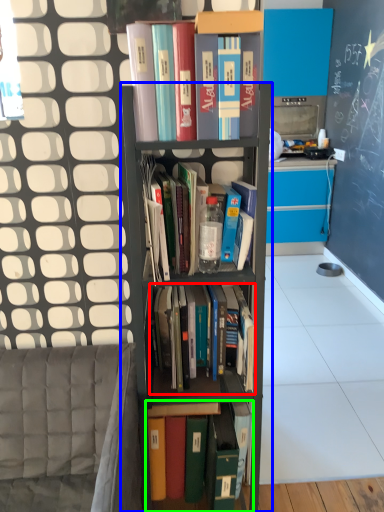
Question: Which object is positioned farthest from book (highlighted by a red box)? Select from shelf (highlighted by a blue box) and book (highlighted by a green box).

Choices:
 (A) shelf
 (B) book

Answer: (B)